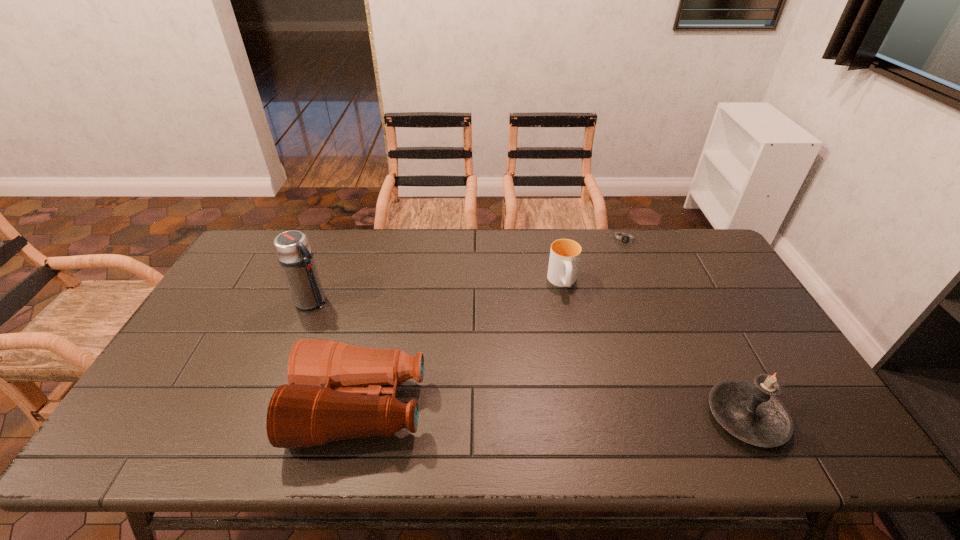
I want to click on free space on the desktop that is between the second object from left to right and the fourth shortest object and is positioned with the handle on the side of the fourth tallest object, so click(x=592, y=414).

Find the location of a particular element. The width and height of the screenshot is (960, 540). free spot on the desktop that is between the third shortest object and the candle and is positioned on the face of the farthest object is located at coordinates (603, 414).

Locate an element on the screen. The image size is (960, 540). free spot on the desktop that is between the binoculars and the candle and is positioned with a handle on the side of the leftmost object is located at coordinates (502, 411).